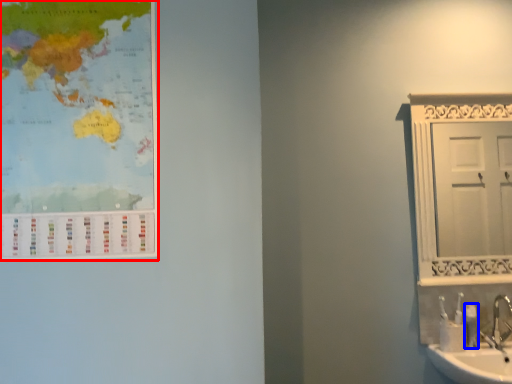
Question: Which object appears farthest to the camera in this image, poster (highlighted by a red box) or toiletry (highlighted by a blue box)?

Choices:
 (A) poster
 (B) toiletry

Answer: (B)